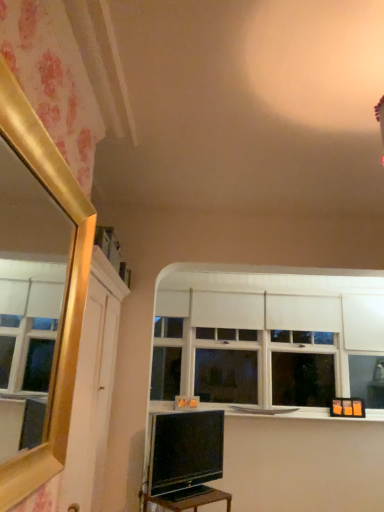
Question: From a real-world perspective, is matte black tv at lower center beneath white matte window sill at center?

Choices:
 (A) no
 (B) yes

Answer: (B)

Question: Does matte black tv at lower center contain white matte window sill at center?

Choices:
 (A) yes
 (B) no

Answer: (B)

Question: From a real-world perspective, is matte black tv at lower center located higher than white matte window sill at center?

Choices:
 (A) yes
 (B) no

Answer: (B)

Question: Is matte black tv at lower center facing towards white matte window sill at center?

Choices:
 (A) yes
 (B) no

Answer: (B)

Question: Is matte black tv at lower center directly adjacent to white matte window sill at center?

Choices:
 (A) no
 (B) yes

Answer: (A)

Question: Can you confirm if matte black tv at lower center is positioned to the right of white matte window sill at center?

Choices:
 (A) yes
 (B) no

Answer: (B)

Question: Is white matte window at center to the left of matte black tv at lower center from the viewer's perspective?

Choices:
 (A) no
 (B) yes

Answer: (A)

Question: Considering the relative sizes of white matte window at center and matte black tv at lower center in the image provided, is white matte window at center smaller than matte black tv at lower center?

Choices:
 (A) yes
 (B) no

Answer: (B)

Question: Can you confirm if white matte window at center is bigger than matte black tv at lower center?

Choices:
 (A) no
 (B) yes

Answer: (B)

Question: Would you say white matte window at center is a long distance from matte black tv at lower center?

Choices:
 (A) yes
 (B) no

Answer: (A)

Question: Is white matte window at center placed right next to matte black tv at lower center?

Choices:
 (A) yes
 (B) no

Answer: (B)

Question: Is white matte window at center at the right side of matte black tv at lower center?

Choices:
 (A) no
 (B) yes

Answer: (B)

Question: From the image's perspective, is black glossy table at lower center located above matte black tv at lower center?

Choices:
 (A) yes
 (B) no

Answer: (B)